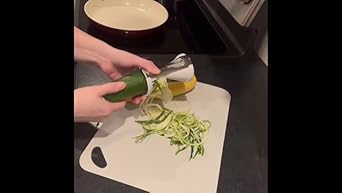
Where is `stove`? stove is located at coordinates (194, 50).